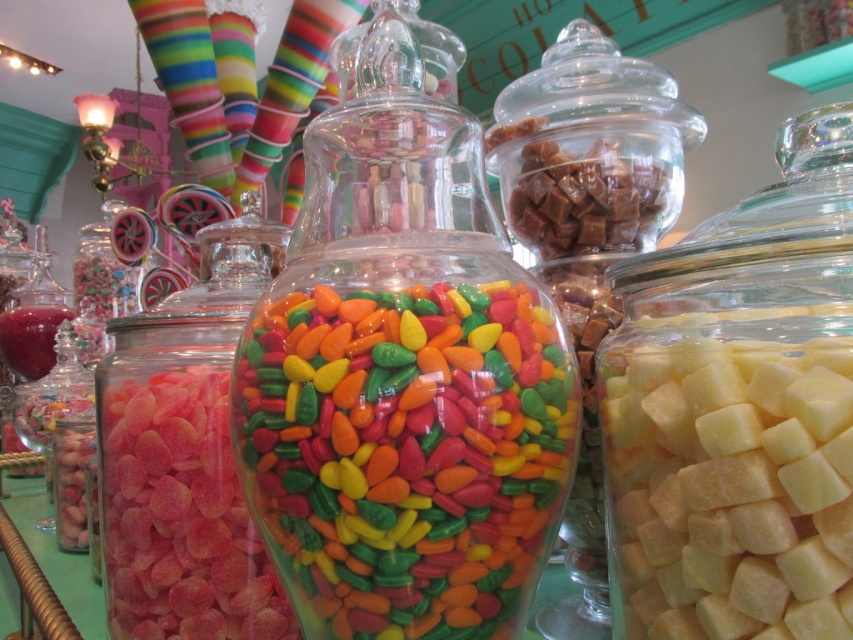
Does translucent glass cubes at right appear over glossy pink gummy at center?

Correct, translucent glass cubes at right is located above glossy pink gummy at center.

Consider the image. Can you confirm if translucent glass cubes at right is wider than glossy pink gummy at center?

No, translucent glass cubes at right is not wider than glossy pink gummy at center.

Is point (711, 628) closer to viewer compared to point (164, 403)?

Yes, point (711, 628) is closer to viewer.

Where is `translucent glass cubes at right`? The image size is (853, 640). translucent glass cubes at right is located at coordinates (738, 412).

In the scene shown: Is glossy glass jar at center further to the viewer compared to glossy pink gummy at center?

That is False.

Between point (416, 582) and point (155, 621), which one is positioned behind?

Point (155, 621)

Who is more forward, (428, 483) or (106, 403)?

Point (428, 483)

Locate an element on the screen. This screenshot has width=853, height=640. glossy glass jar at center is located at coordinates (405, 451).

Consider the image. Can you confirm if translucent glass cubes at right is bigger than glossy glass jar at center?

Yes.

Is translucent glass cubes at right to the left of glossy glass jar at center from the viewer's perspective?

In fact, translucent glass cubes at right is to the right of glossy glass jar at center.

In order to click on translucent glass cubes at right in this screenshot , I will do `click(738, 412)`.